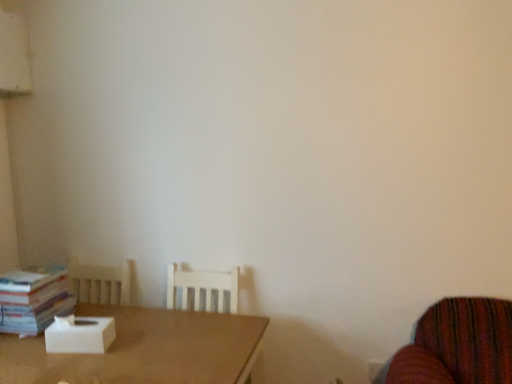
What is the approximate width of brown matte table at lower left?

brown matte table at lower left is 68.93 centimeters wide.

Where is `brown matte table at lower left`? The width and height of the screenshot is (512, 384). brown matte table at lower left is located at coordinates (143, 349).

Is point (178, 374) farther from camera compared to point (115, 331)?

No, (178, 374) is closer to viewer.

Consider the image. From the image's perspective, would you say brown matte table at lower left is shown under white cardboard box at center?

Correct, brown matte table at lower left appears lower than white cardboard box at center in the image.

Does brown matte table at lower left have a lesser width compared to white cardboard box at center?

In fact, brown matte table at lower left might be wider than white cardboard box at center.

How different are the orientations of brown matte table at lower left and white cardboard box at center in degrees?

There is a 7.06-degree angle between the facing directions of brown matte table at lower left and white cardboard box at center.

Considering the sizes of objects white cardboard box at center and white paper book at left in the image provided, who is wider, white cardboard box at center or white paper book at left?

With larger width is white paper book at left.

From the picture: From a real-world perspective, is white cardboard box at center positioned under white paper book at left based on gravity?

Indeed, from a real-world perspective, white cardboard box at center is positioned beneath white paper book at left.

Considering the positions of objects white cardboard box at center and white paper book at left in the image provided, who is behind, white cardboard box at center or white paper book at left?

white paper book at left is further away from the camera.

What's the angular difference between white cardboard box at center and brown matte table at lower left's facing directions?

The angular difference between white cardboard box at center and brown matte table at lower left is 7.06 degrees.

From a real-world perspective, is white cardboard box at center on top of brown matte table at lower left?

Yes, from a real-world perspective, white cardboard box at center is above brown matte table at lower left.

Are white cardboard box at center and brown matte table at lower left located far from each other?

No.

Which of these two, white cardboard box at center or brown matte table at lower left, is thinner?

With smaller width is white cardboard box at center.

From the picture: Which is more to the left, brown matte table at lower left or white paper book at left?

Positioned to the left is white paper book at left.

From the image's perspective, which one is positioned lower, brown matte table at lower left or white paper book at left?

brown matte table at lower left is shown below in the image.

Measure the distance between brown matte table at lower left and white paper book at left.

brown matte table at lower left is 13.15 inches from white paper book at left.

Considering the positions of objects brown matte table at lower left and white paper book at left in the image provided, who is in front, brown matte table at lower left or white paper book at left?

brown matte table at lower left is closer to the camera.

Considering the sizes of objects white paper book at left and white cardboard box at center in the image provided, who is taller, white paper book at left or white cardboard box at center?

white paper book at left is taller.

Is white paper book at left smaller than white cardboard box at center?

Actually, white paper book at left might be larger than white cardboard box at center.

Is white paper book at left at the right side of white cardboard box at center?

In fact, white paper book at left is to the left of white cardboard box at center.

Is white paper book at left looking in the opposite direction of brown matte table at lower left?

white paper book at left does not have its back to brown matte table at lower left.

How much distance is there between white paper book at left and brown matte table at lower left?

The distance of white paper book at left from brown matte table at lower left is 13.15 inches.

Considering the sizes of white paper book at left and brown matte table at lower left in the image, is white paper book at left wider or thinner than brown matte table at lower left?

In the image, white paper book at left appears to be more narrow than brown matte table at lower left.

What's the angular difference between white paper book at left and brown matte table at lower left's facing directions?

They differ by 89.8 degrees in their facing directions.

You are a GUI agent. You are given a task and a screenshot of the screen. Output one action in this format:
    pyautogui.click(x=<x>, y=<y>)
    Task: Click on the table on the right side of white cardboard box at center
    
    Given the screenshot: What is the action you would take?
    pyautogui.click(x=143, y=349)

Locate an element on the screen. book above the white cardboard box at center (from the image's perspective) is located at coordinates (33, 299).

Which object lies nearer to the anchor point white paper book at left, brown matte table at lower left or white cardboard box at center?

Based on the image, white cardboard box at center appears to be nearer to white paper book at left.

When comparing their distances from white paper book at left, does white cardboard box at center or brown matte table at lower left seem closer?

white cardboard box at center is positioned closer to the anchor white paper book at left.

Looking at the image, which one is located closer to white cardboard box at center, white paper book at left or brown matte table at lower left?

Based on the image, brown matte table at lower left appears to be nearer to white cardboard box at center.

From the picture: Looking at the image, which one is located closer to white cardboard box at center, brown matte table at lower left or white paper book at left?

brown matte table at lower left is positioned closer to the anchor white cardboard box at center.

Based on the photo, looking at the image, which one is located closer to brown matte table at lower left, white paper book at left or white cardboard box at center?

white cardboard box at center lies closer to brown matte table at lower left than the other object.

Looking at the image, which one is located closer to brown matte table at lower left, white cardboard box at center or white paper book at left?

white cardboard box at center is closer to brown matte table at lower left.

Image resolution: width=512 pixels, height=384 pixels. I want to click on cardboard box positioned between brown matte table at lower left and white paper book at left from near to far, so point(80,335).